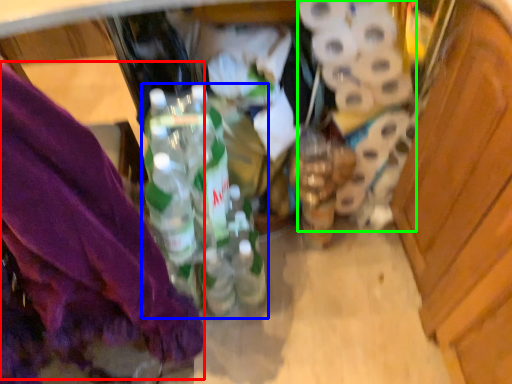
Question: Which is farther away from underclothes (highlighted by a red box)? bottle (highlighted by a blue box) or toilet paper (highlighted by a green box)?

Choices:
 (A) bottle
 (B) toilet paper

Answer: (B)